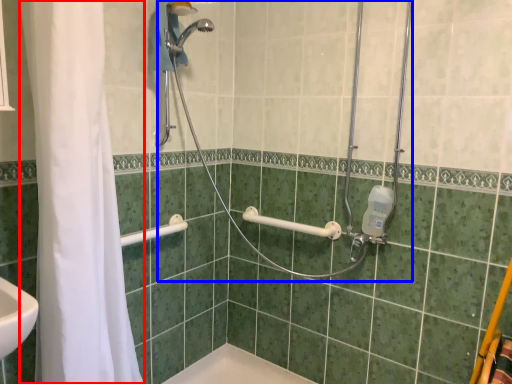
Question: Which object appears closest to the camera in this image, shower curtain (highlighted by a red box) or shower (highlighted by a blue box)?

Choices:
 (A) shower curtain
 (B) shower

Answer: (A)